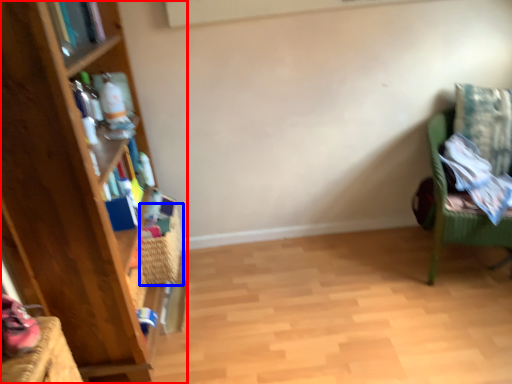
Question: Which object is closer to the camera taking this photo, bookcase (highlighted by a red box) or basket (highlighted by a blue box)?

Choices:
 (A) bookcase
 (B) basket

Answer: (A)